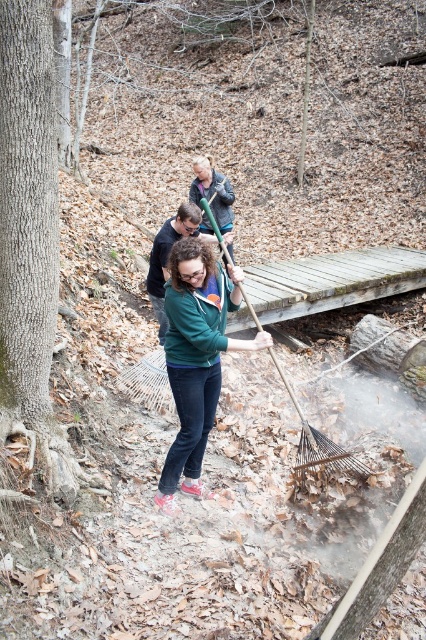
Question: Can you confirm if matte green sweater at center is thinner than dark blue jeans at center?

Choices:
 (A) yes
 (B) no

Answer: (B)

Question: Which point is closer to the camera taking this photo?

Choices:
 (A) (178, 225)
 (B) (226, 257)
 (C) (201, 189)
 (D) (161, 509)

Answer: (D)

Question: Is matte green sweater at center smaller than dark blue jeans at center?

Choices:
 (A) no
 (B) yes

Answer: (A)

Question: Which is farther from the wooden rake at center?

Choices:
 (A) matte green sweater at center
 (B) dark blue jeans at center

Answer: (B)

Question: Which object appears closest to the camera in this image?

Choices:
 (A) dark blue jacket at upper center
 (B) matte green sweater at center
 (C) dark blue jeans at center

Answer: (B)

Question: Does dark blue jeans at center have a smaller size compared to dark blue jacket at upper center?

Choices:
 (A) no
 (B) yes

Answer: (A)